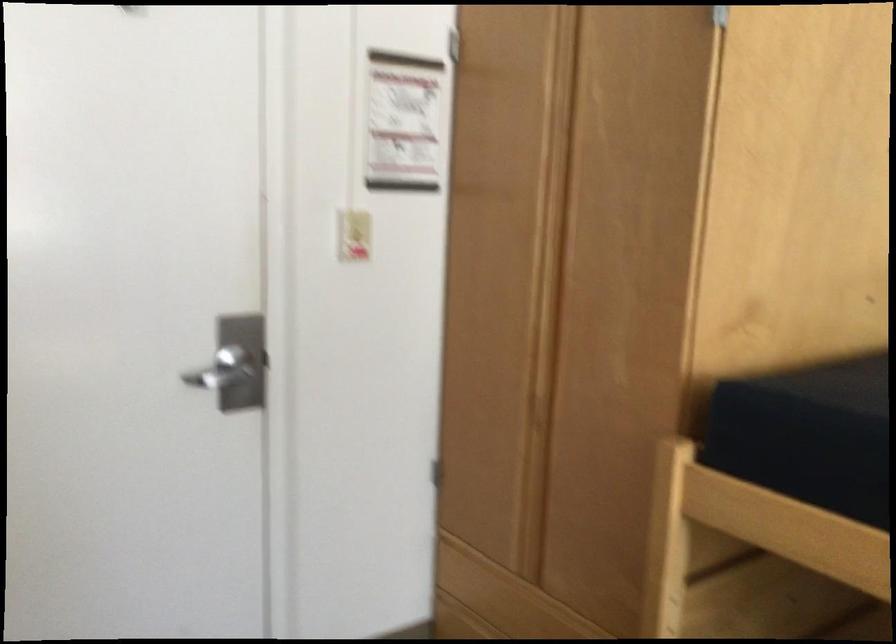
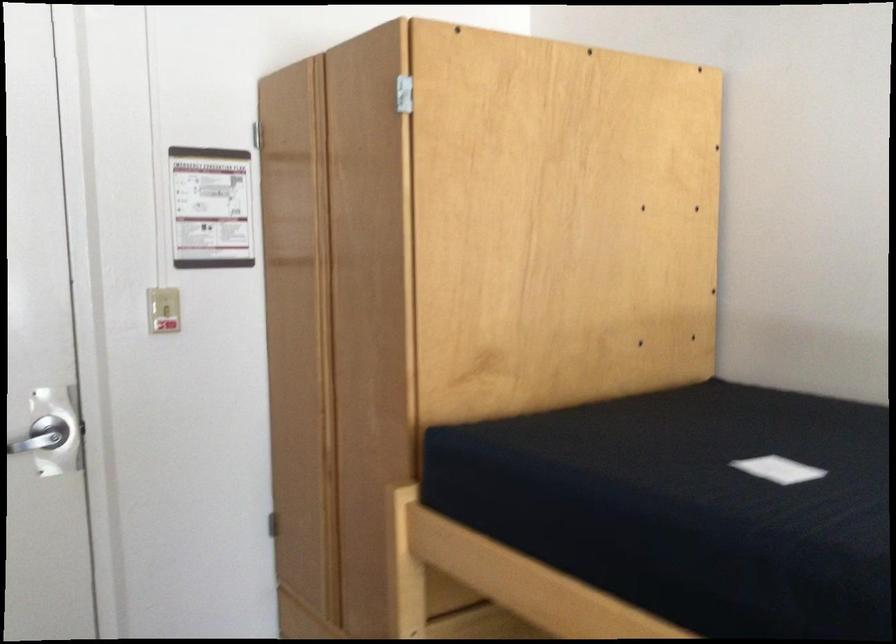
Locate, in the second image, the point that corresponds to (x=240, y=372) in the first image.

(47, 440)